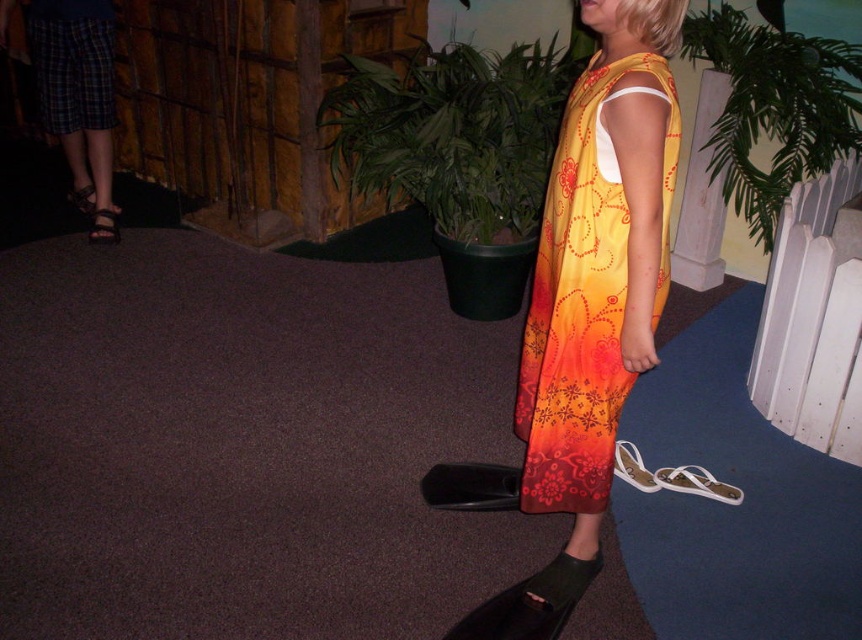
Question: Can you confirm if green leafy plant at upper right is bigger than brown leather sandal at left?

Choices:
 (A) yes
 (B) no

Answer: (A)

Question: Estimate the real-world distances between objects in this image. Which object is farther from the plaid fabric skirt at left?

Choices:
 (A) floral print fabric dress at center
 (B) green leafy plant at upper center

Answer: (A)

Question: Which of these objects is positioned closest to the plaid fabric skirt at left?

Choices:
 (A) black rubber sandal at lower right
 (B) brown leather sandal at left

Answer: (B)

Question: Can you confirm if plaid fabric skirt at left is bigger than black rubber sandal at lower right?

Choices:
 (A) no
 (B) yes

Answer: (B)

Question: Considering the real-world distances, which object is farthest from the brown leather sandal at left?

Choices:
 (A) green leafy plant at upper right
 (B) green leafy plant at upper center
 (C) plaid fabric skirt at left

Answer: (A)

Question: Is plaid fabric skirt at left wider than brown leather sandal at left?

Choices:
 (A) no
 (B) yes

Answer: (B)